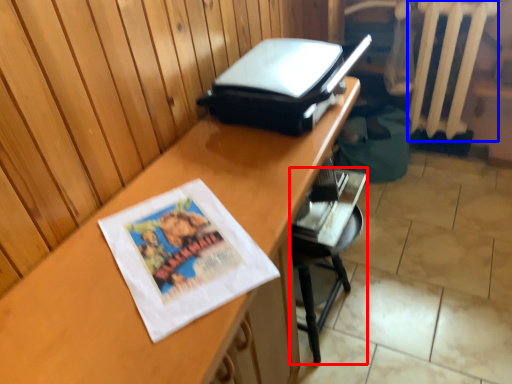
Question: Which point is closer to the camera, furniture (highlighted by a red box) or radiator (highlighted by a blue box)?

Choices:
 (A) furniture
 (B) radiator

Answer: (A)